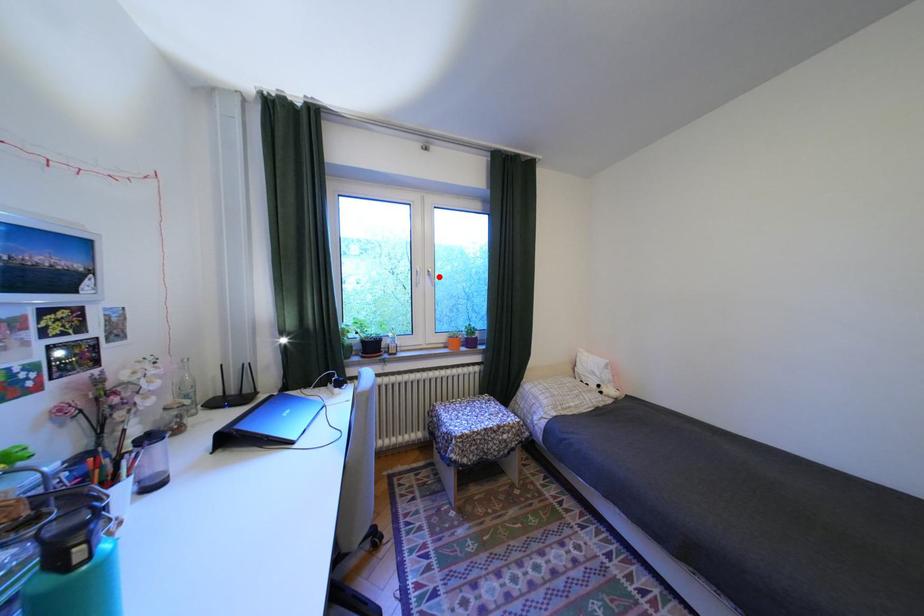
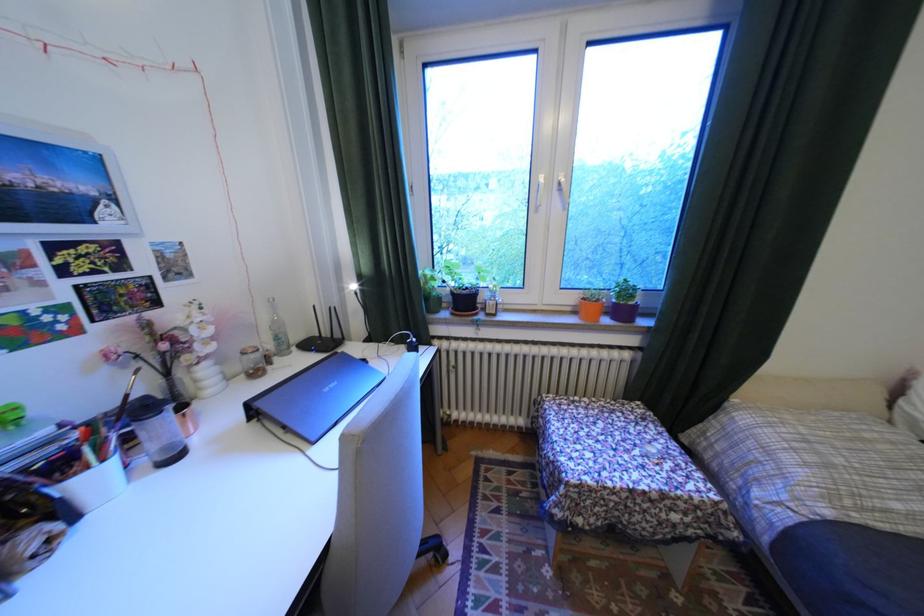
The point at the highlighted location is marked in the first image. Where is the corresponding point in the second image?

(566, 195)